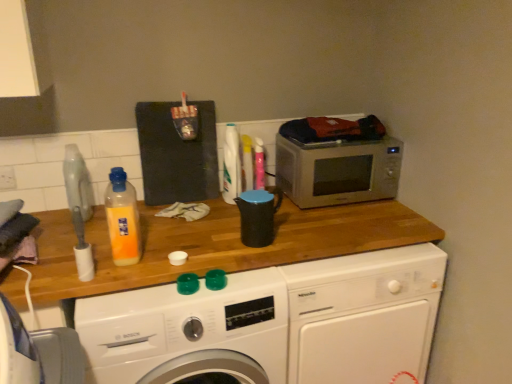
I want to click on free spot in front of black plastic kettle at center, so click(257, 277).